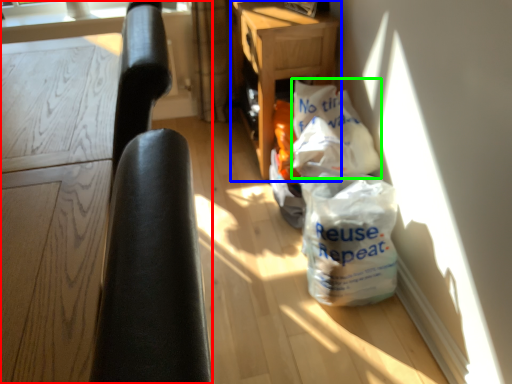
Question: Estimate the real-world distances between objects in this image. Which object is farther from furniture (highlighted by a red box), table (highlighted by a blue box) or grocery bag (highlighted by a green box)?

Choices:
 (A) table
 (B) grocery bag

Answer: (A)